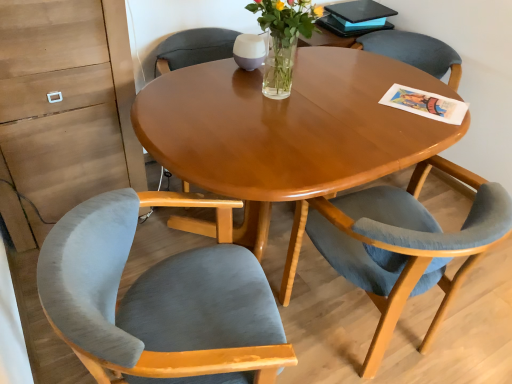
I want to click on velvet blue chair at lower right, positioned as the 1th chair in right-to-left order, so click(x=398, y=245).

Find the location of `velvet blue chair at lower right, positioned as the second chair in left-to-right order`. velvet blue chair at lower right, positioned as the second chair in left-to-right order is located at coordinates (398, 245).

Between velvet blue chair at lower right, positioned as the second chair in left-to-right order, and velvet grey chair at left, the second chair when ordered from right to left, which one has more height?

velvet grey chair at left, the second chair when ordered from right to left, is taller.

Can you tell me how much velvet blue chair at lower right, positioned as the second chair in left-to-right order, and velvet grey chair at left, which is counted as the first chair, starting from the left, differ in facing direction?

The angular difference between velvet blue chair at lower right, positioned as the second chair in left-to-right order, and velvet grey chair at left, which is counted as the first chair, starting from the left, is 99 degrees.

From the image's perspective, which object appears higher, velvet blue chair at lower right, positioned as the 1th chair in right-to-left order, or velvet grey chair at left, the second chair when ordered from right to left?

velvet blue chair at lower right, positioned as the 1th chair in right-to-left order, from the image's perspective.

Is velvet blue chair at lower right, positioned as the 1th chair in right-to-left order, looking in the opposite direction of velvet grey chair at left, the second chair when ordered from right to left?

velvet blue chair at lower right, positioned as the 1th chair in right-to-left order, is not turned away from velvet grey chair at left, the second chair when ordered from right to left.

This screenshot has width=512, height=384. I want to click on chair on the left of clear glass vase at center, so click(x=158, y=304).

Would you say velvet grey chair at left, which is counted as the first chair, starting from the left, contains clear glass vase at center?

That's incorrect, clear glass vase at center is not inside velvet grey chair at left, which is counted as the first chair, starting from the left.

How different are the orientations of velvet grey chair at left, which is counted as the first chair, starting from the left, and clear glass vase at center in degrees?

They differ by 72.3 degrees in their facing directions.

Can you confirm if velvet grey chair at left, which is counted as the first chair, starting from the left, is positioned to the left of clear glass vase at center?

Indeed, velvet grey chair at left, which is counted as the first chair, starting from the left, is positioned on the left side of clear glass vase at center.

Which of these two, clear glass vase at center or velvet grey chair at left, which is counted as the first chair, starting from the left, stands shorter?

With less height is clear glass vase at center.

Is clear glass vase at center oriented away from velvet grey chair at left, the second chair when ordered from right to left?

No.

Locate an element on the screen. floral arrangement that is above the velvet grey chair at left, which is counted as the first chair, starting from the left (from a real-world perspective) is located at coordinates (283, 39).

Considering the relative positions of clear glass vase at center and velvet grey chair at left, the second chair when ordered from right to left, in the image provided, is clear glass vase at center behind velvet grey chair at left, the second chair when ordered from right to left,?

Yes, it is behind velvet grey chair at left, the second chair when ordered from right to left.

Considering the positions of points (445, 298) and (298, 29), is point (445, 298) closer to camera compared to point (298, 29)?

No.

Based on their positions, is velvet blue chair at lower right, positioned as the 1th chair in right-to-left order, located to the left or right of clear glass vase at center?

From the image, it's evident that velvet blue chair at lower right, positioned as the 1th chair in right-to-left order, is to the right of clear glass vase at center.

Considering the relative sizes of velvet blue chair at lower right, positioned as the 1th chair in right-to-left order, and clear glass vase at center in the image provided, is velvet blue chair at lower right, positioned as the 1th chair in right-to-left order, taller than clear glass vase at center?

Yes.

Based on their sizes in the image, would you say velvet blue chair at lower right, positioned as the second chair in left-to-right order, is bigger or smaller than clear glass vase at center?

In the image, velvet blue chair at lower right, positioned as the second chair in left-to-right order, appears to be larger than clear glass vase at center.

Identify the location of chair on the right side of velvet grey chair at left, which is counted as the first chair, starting from the left. (398, 245).

From the image's perspective, is velvet grey chair at left, which is counted as the first chair, starting from the left, located above or below velvet blue chair at lower right, positioned as the second chair in left-to-right order?

velvet grey chair at left, which is counted as the first chair, starting from the left, is situated lower than velvet blue chair at lower right, positioned as the second chair in left-to-right order, in the image.

Is velvet grey chair at left, which is counted as the first chair, starting from the left, far from velvet blue chair at lower right, positioned as the second chair in left-to-right order?

No, there isn't a large distance between velvet grey chair at left, which is counted as the first chair, starting from the left, and velvet blue chair at lower right, positioned as the second chair in left-to-right order.

Considering the relative sizes of velvet grey chair at left, which is counted as the first chair, starting from the left, and velvet blue chair at lower right, positioned as the second chair in left-to-right order, in the image provided, is velvet grey chair at left, which is counted as the first chair, starting from the left, bigger than velvet blue chair at lower right, positioned as the second chair in left-to-right order,?

Actually, velvet grey chair at left, which is counted as the first chair, starting from the left, might be smaller than velvet blue chair at lower right, positioned as the second chair in left-to-right order.

Considering the sizes of objects clear glass vase at center and velvet blue chair at lower right, positioned as the second chair in left-to-right order, in the image provided, who is bigger, clear glass vase at center or velvet blue chair at lower right, positioned as the second chair in left-to-right order,?

velvet blue chair at lower right, positioned as the second chair in left-to-right order, is bigger.

From a real-world perspective, who is located lower, clear glass vase at center or velvet blue chair at lower right, positioned as the 1th chair in right-to-left order?

velvet blue chair at lower right, positioned as the 1th chair in right-to-left order, is physically lower.

Which object is thinner, clear glass vase at center or velvet blue chair at lower right, positioned as the second chair in left-to-right order?

With smaller width is clear glass vase at center.

Which is in front, point (269, 61) or point (430, 333)?

The point (269, 61) is closer.

This screenshot has height=384, width=512. Identify the location of chair that appears above the velvet grey chair at left, which is counted as the first chair, starting from the left (from a real-world perspective). (398, 245).

Image resolution: width=512 pixels, height=384 pixels. What are the coordinates of `chair that appears on the left of clear glass vase at center` in the screenshot? It's located at (158, 304).

Looking at the image, which one is located closer to velvet blue chair at lower right, positioned as the second chair in left-to-right order, velvet grey chair at left, the second chair when ordered from right to left, or clear glass vase at center?

velvet grey chair at left, the second chair when ordered from right to left, is closer to velvet blue chair at lower right, positioned as the second chair in left-to-right order.

From the image, which object appears to be nearer to velvet blue chair at lower right, positioned as the 1th chair in right-to-left order, clear glass vase at center or velvet grey chair at left, which is counted as the first chair, starting from the left?

Based on the image, velvet grey chair at left, which is counted as the first chair, starting from the left, appears to be nearer to velvet blue chair at lower right, positioned as the 1th chair in right-to-left order.

Which object lies nearer to the anchor point velvet grey chair at left, which is counted as the first chair, starting from the left, clear glass vase at center or velvet blue chair at lower right, positioned as the 1th chair in right-to-left order?

The object closer to velvet grey chair at left, which is counted as the first chair, starting from the left, is velvet blue chair at lower right, positioned as the 1th chair in right-to-left order.

Considering their positions, is velvet blue chair at lower right, positioned as the 1th chair in right-to-left order, positioned further to velvet grey chair at left, which is counted as the first chair, starting from the left, than clear glass vase at center?

clear glass vase at center is further to velvet grey chair at left, which is counted as the first chair, starting from the left.

Looking at the image, which one is located closer to clear glass vase at center, velvet blue chair at lower right, positioned as the second chair in left-to-right order, or velvet grey chair at left, which is counted as the first chair, starting from the left?

Among the two, velvet blue chair at lower right, positioned as the second chair in left-to-right order, is located nearer to clear glass vase at center.

Estimate the real-world distances between objects in this image. Which object is further from clear glass vase at center, velvet grey chair at left, which is counted as the first chair, starting from the left, or velvet blue chair at lower right, positioned as the second chair in left-to-right order?

Based on the image, velvet grey chair at left, which is counted as the first chair, starting from the left, appears to be further to clear glass vase at center.

Identify the location of chair between clear glass vase at center and velvet grey chair at left, which is counted as the first chair, starting from the left, vertically. The width and height of the screenshot is (512, 384). (398, 245).